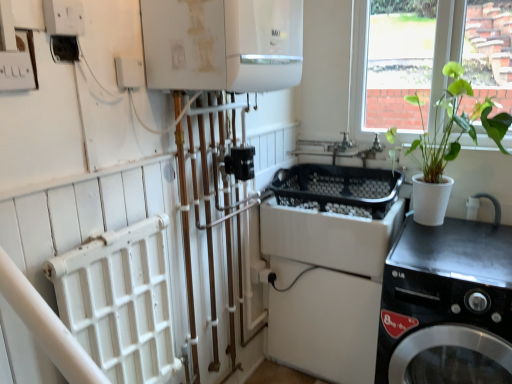
Question: Is black glossy washing machine at lower right spatially inside transparent glass window at upper right, or outside of it?

Choices:
 (A) outside
 (B) inside

Answer: (A)

Question: In the image, is black glossy washing machine at lower right on the left side or the right side of transparent glass window at upper right?

Choices:
 (A) left
 (B) right

Answer: (A)

Question: Which is farther from the green leafy plant in white pot at right?

Choices:
 (A) transparent glass window at upper right
 (B) black glossy washing machine at lower right
 (C) white glossy boiler at upper center
 (D) white plastic electric outlet at upper left

Answer: (D)

Question: Estimate the real-world distances between objects in this image. Which object is closer to the green leafy plant in white pot at right?

Choices:
 (A) white glossy boiler at upper center
 (B) white plastic electric outlet at upper left
 (C) black glossy washing machine at lower right
 (D) transparent glass window at upper right

Answer: (D)